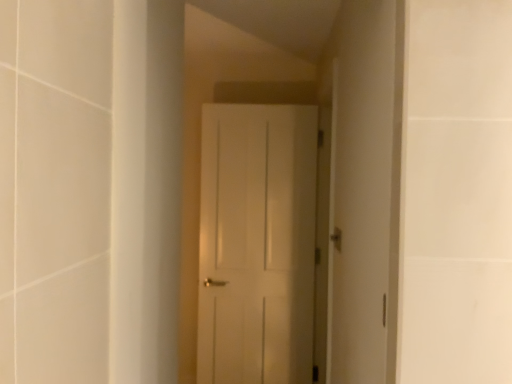
Question: Is point (260, 283) positioned closer to the camera than point (337, 240)?

Choices:
 (A) closer
 (B) farther

Answer: (B)

Question: Which is correct: white matte door at center is inside gold metallic door handle at center, or outside of it?

Choices:
 (A) outside
 (B) inside

Answer: (A)

Question: Considering their positions, is white matte door at center located in front of or behind gold metallic door handle at center?

Choices:
 (A) behind
 (B) front

Answer: (A)

Question: Is gold metallic door handle at center wider or thinner than white matte door at center?

Choices:
 (A) wide
 (B) thin

Answer: (B)

Question: Looking at the image, does gold metallic door handle at center seem bigger or smaller compared to white matte door at center?

Choices:
 (A) small
 (B) big

Answer: (A)

Question: From the image's perspective, is gold metallic door handle at center positioned above or below white matte door at center?

Choices:
 (A) above
 (B) below

Answer: (A)

Question: Is gold metallic door handle at center inside the boundaries of white matte door at center, or outside?

Choices:
 (A) outside
 (B) inside

Answer: (A)